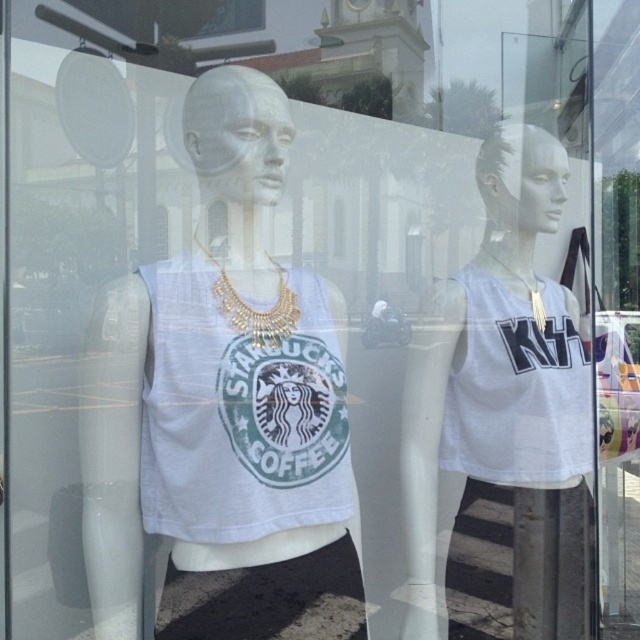
You are a customer at the store and want to know which tank top is on the left side between the white matte tank top at center and the white fabric tank top at center. Can you tell me?

The white matte tank top at center is positioned on the left side of the white fabric tank top at center, so the white matte tank top at center is on the left.

You are standing at point [179,448] and want to walk to the Starbucks Coffee logo on the left mannequin. Can you reach it without crossing the 5 feet distance limit?

The distance between you at point [179,448] and the Starbucks Coffee logo on the left mannequin is 4.58 feet, which is within the 5 feet limit. Yes, you can reach it without crossing the distance limit.

You are a store employee who needs to place a new mannequin between the white matte tank top at center and another mannequin. The new mannequin is 0.5 meters wide. Is there enough space between them to fit the new mannequin?

The distance between the white matte tank top at center and the other mannequin is 1.37 meters. Subtracting the width of the new mannequin, which is 0.5 meters, leaves 0.87 meters of space. Since 0.87 meters is greater than zero, there is enough space to place the new mannequin between them.